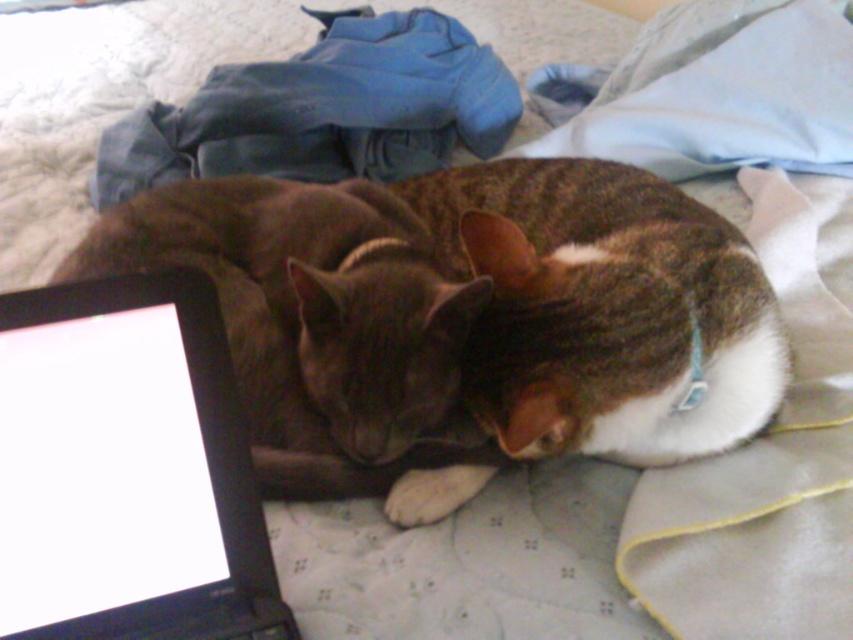
Question: Which of the following is the farthest from the observer?

Choices:
 (A) dark brown fur cat at center
 (B) black plastic laptop at lower left

Answer: (A)

Question: Which of the following is the closest to the observer?

Choices:
 (A) black plastic laptop at lower left
 (B) dark brown fur cat at center

Answer: (A)

Question: Does black plastic laptop at lower left appear under dark brown fur cat at center?

Choices:
 (A) yes
 (B) no

Answer: (A)

Question: Does black plastic laptop at lower left come in front of dark brown fur cat at center?

Choices:
 (A) no
 (B) yes

Answer: (B)

Question: Does black plastic laptop at lower left lie in front of dark brown fur cat at center?

Choices:
 (A) yes
 (B) no

Answer: (A)